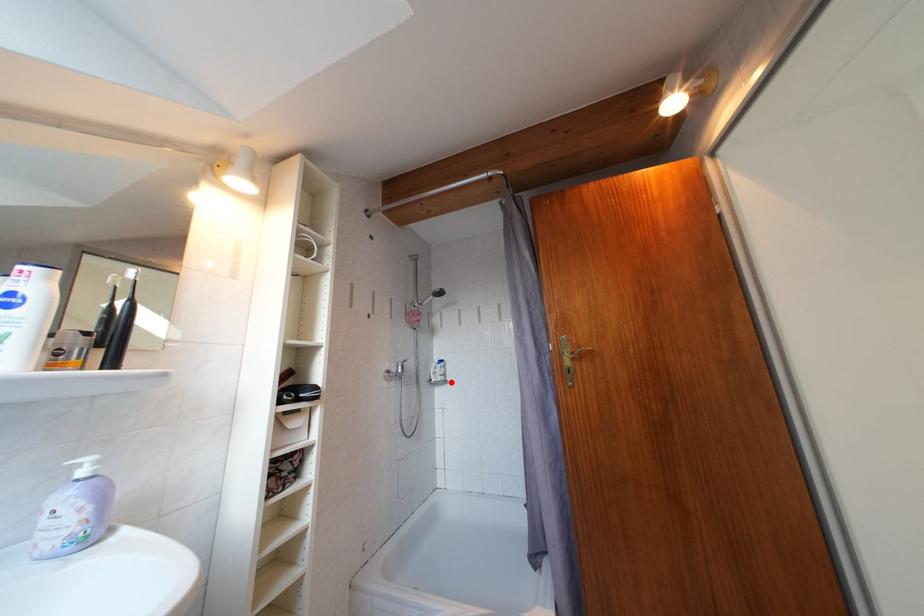
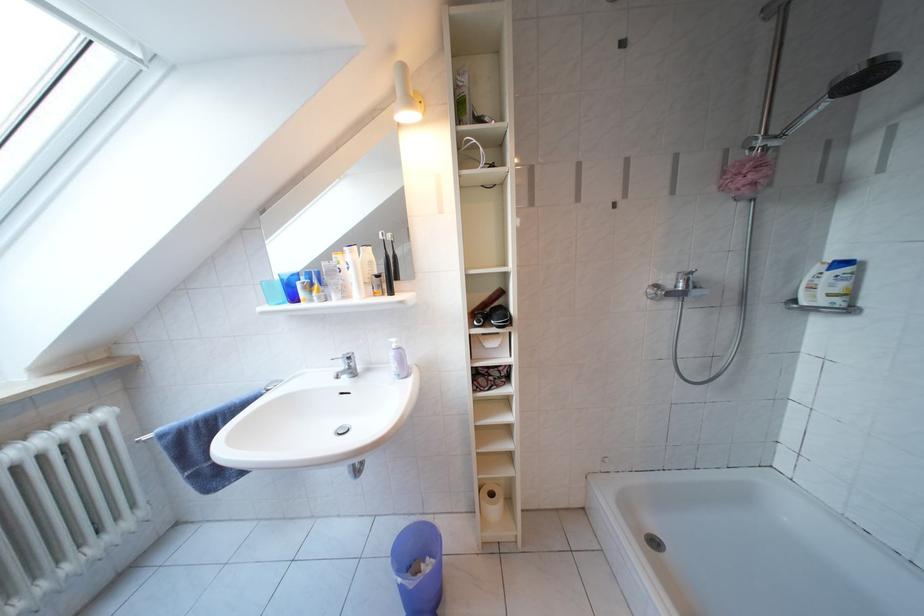
The point at the highlighted location is marked in the first image. Where is the corresponding point in the second image?

(846, 306)